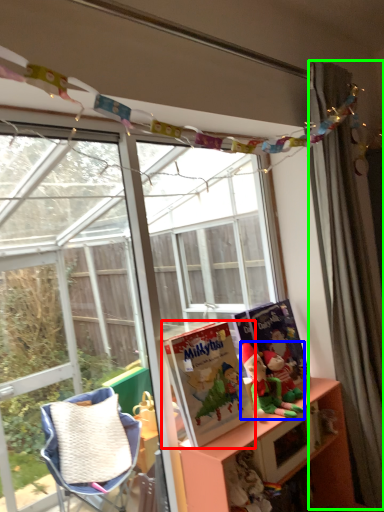
Question: Considering the real-world distances, which object is farthest from book (highlighted by a red box)? person (highlighted by a blue box) or curtain (highlighted by a green box)?

Choices:
 (A) person
 (B) curtain

Answer: (B)